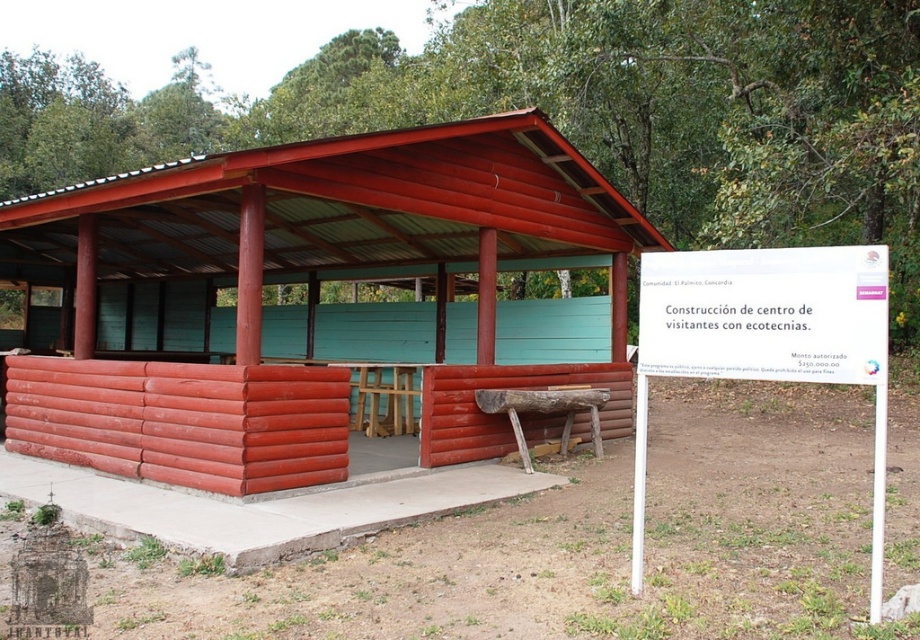
Question: Where is white plastic sign at center right located in relation to wooden picnic table at center in the image?

Choices:
 (A) left
 (B) right

Answer: (B)

Question: Does white plastic sign at center right lie behind wooden picnic table at center?

Choices:
 (A) yes
 (B) no

Answer: (B)

Question: Which point is farther to the camera?

Choices:
 (A) white plastic sign at center right
 (B) matte red log cabin at center

Answer: (B)

Question: Where is matte red log cabin at center located in relation to wooden picnic table at center in the image?

Choices:
 (A) above
 (B) below

Answer: (A)

Question: Which of these objects is positioned closest to the white plastic sign at center right?

Choices:
 (A) matte red log cabin at center
 (B) wooden picnic table at center

Answer: (B)

Question: Among these points, which one is nearest to the camera?

Choices:
 (A) pyautogui.click(x=486, y=396)
 (B) pyautogui.click(x=640, y=467)
 (C) pyautogui.click(x=219, y=195)

Answer: (B)